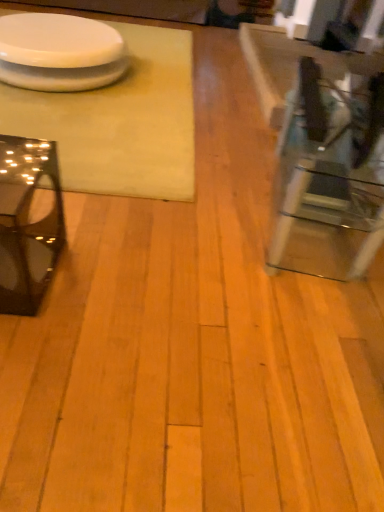
At what (x,y) coordinates should I click in order to perform the action: click on vacant space that is in between clear glass table at right, the first table in the right-to-left sequence, and glossy black glass table at left, which is the second table in right-to-left order. Please return your answer as a coordinate pair (x, y). The height and width of the screenshot is (512, 384). Looking at the image, I should click on [177, 244].